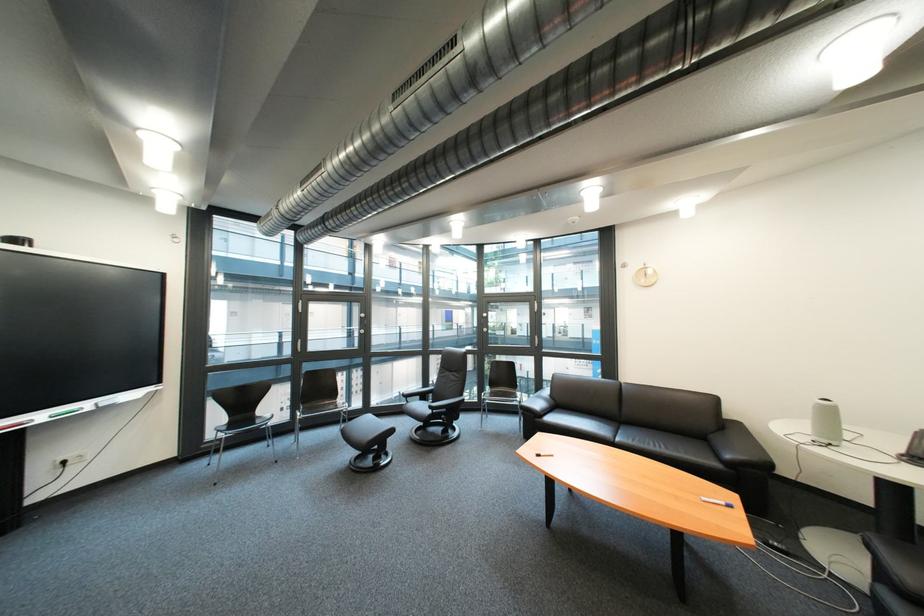
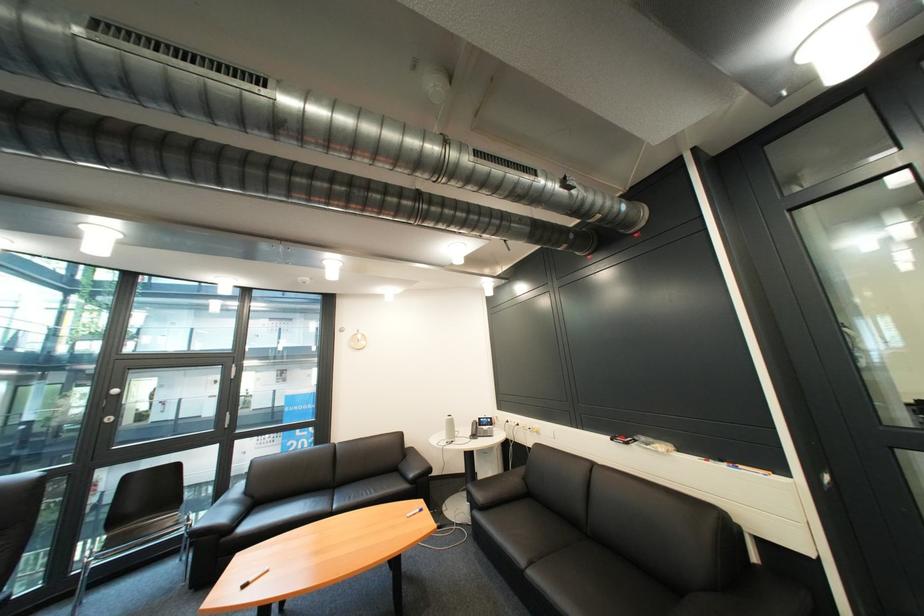
The point at (x=565, y=403) is marked in the first image. Where is the corresponding point in the second image?

(262, 503)